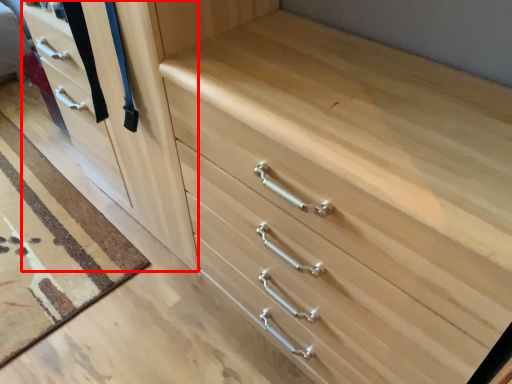
Question: From the image, what is the correct spatial relationship of door (annotated by the red box) in relation to drawer?

Choices:
 (A) left
 (B) right

Answer: (A)